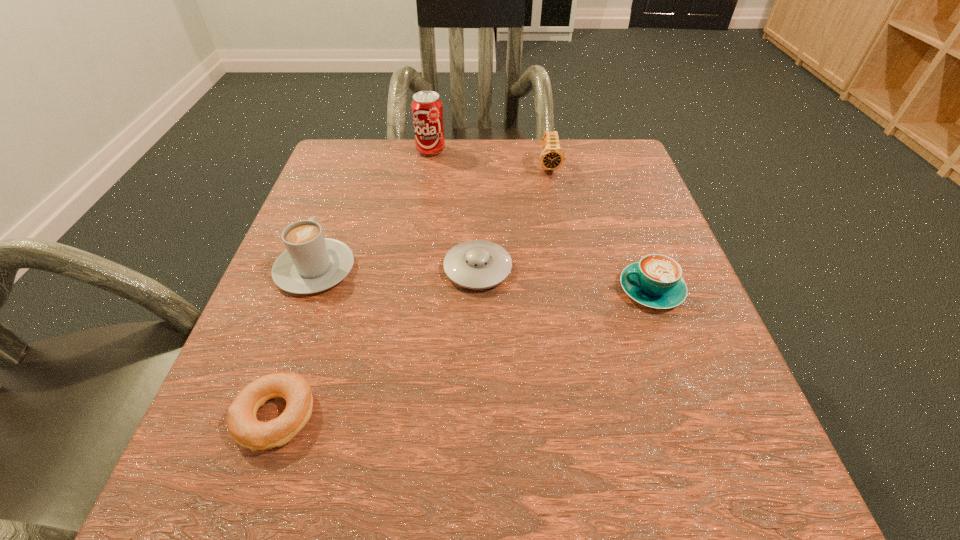
This screenshot has height=540, width=960. Find the location of `free space between the tallest object and the saucer`. free space between the tallest object and the saucer is located at coordinates (454, 210).

Select which object appears as the third closest to the watch. Please provide its 2D coordinates. Your answer should be formatted as a tuple, i.e. [(x, y)], where the tuple contains the x and y coordinates of a point satisfying the conditions above.

[(656, 281)]

This screenshot has width=960, height=540. Find the location of `object that is the fourth closest to the watch`. object that is the fourth closest to the watch is located at coordinates (311, 263).

Find the location of `vacant space that satisfies the following two spatial constraints: 1. to the right of the taller cappuccino; 2. on the right side of the tallest object`. vacant space that satisfies the following two spatial constraints: 1. to the right of the taller cappuccino; 2. on the right side of the tallest object is located at coordinates (359, 151).

Identify the location of free region that satisfies the following two spatial constraints: 1. on the front side of the fourth object from right to left; 2. on the right side of the saucer. The height and width of the screenshot is (540, 960). tap(413, 269).

Identify the location of free space in the image that satisfies the following two spatial constraints: 1. on the front side of the soda; 2. on the left side of the fourth object from left to right. This screenshot has width=960, height=540. (413, 269).